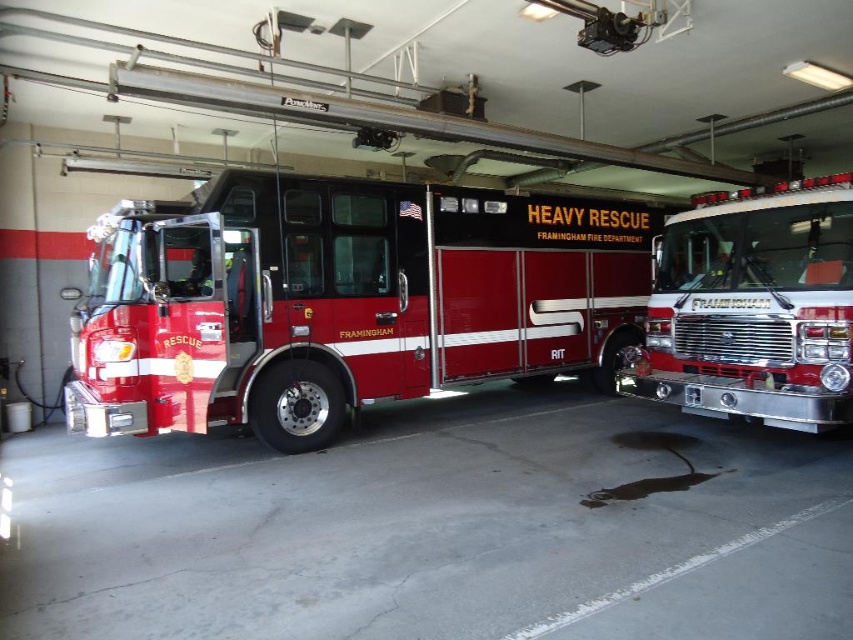
You are a firefighter who needs to quickly exit the fire station through the main door located at the far left of the image. You are currently standing next to the shiny red fire truck at center. Can you reach the door before the shiny chrome fire truck at right, which is 1.5 meters wide, blocks your path? The distance between the two trucks is 4.99 meters.

The shiny red fire truck at center is 4.99 meters away from the shiny chrome fire truck at right. Since the chrome truck is 1.5 meters wide, the path between them is at least 4.99 meters minus 1.5 meters, which leaves 3.49 meters of space. This should be sufficient for you to maneuver around or through the gap safely to reach the door.

You are a firefighter who needs to choose a vehicle to carry equipment. The shiny red fire truck at center and the shiny chrome fire truck at right are available. Which one has more vertical space inside for storing tall equipment?

The shiny chrome fire truck at right is taller than the shiny red fire truck at center, so it has more vertical space inside for storing tall equipment.